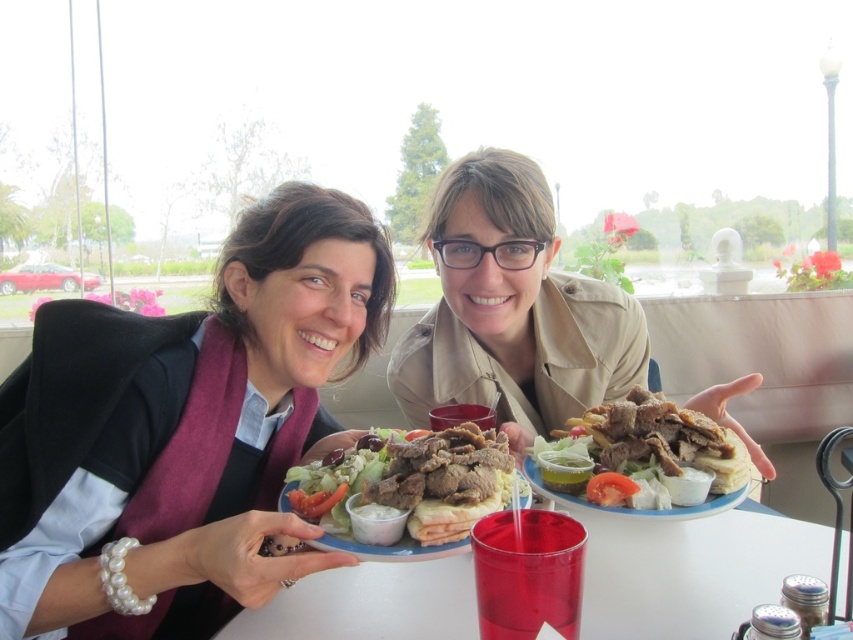
You are a waiter in a restaurant and need to place a new drink order on the table. The table already has a matte black sweater at center and a transparent plastic cup at center. Where should you place the new drink to avoid placing it under any objects?

The new drink should be placed on the table where it won not be under any objects. Since the matte black sweater at center is above the transparent plastic cup at center, placing the drink next to the transparent plastic cup at center or the matte black sweater at center would avoid placing it under any objects.

You are a waiter in a restaurant and you see the matte black plate at center and the matte black sweater at center on the table. Which item is closer to the ceiling?

The matte black plate at center is above the matte black sweater at center, so the matte black plate at center is closer to the ceiling.